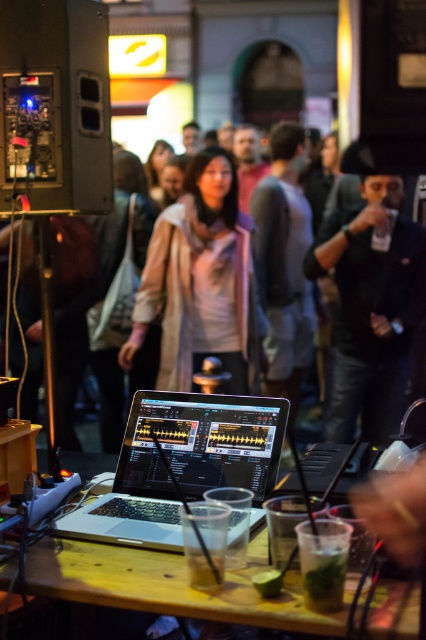
Question: Which object appears closest to the camera in this image?

Choices:
 (A) silver/black matte laptop at center
 (B) black leather jacket at right
 (C) wooden table at center

Answer: (C)

Question: Which point is farther to the camera?

Choices:
 (A) black leather jacket at right
 (B) matte white shirt at center
 (C) silver/black matte laptop at center
 (D) wooden table at center

Answer: (B)

Question: Is black leather jacket at right wider than silver/black matte laptop at center?

Choices:
 (A) no
 (B) yes

Answer: (B)

Question: Where is silver/black matte laptop at center located in relation to matte white shirt at center in the image?

Choices:
 (A) above
 (B) below

Answer: (B)

Question: Is black leather jacket at right closer to camera compared to silver/black matte laptop at center?

Choices:
 (A) no
 (B) yes

Answer: (A)

Question: Which object is positioned farthest from the black leather jacket at right?

Choices:
 (A) silver/black matte laptop at center
 (B) wooden table at center
 (C) matte white shirt at center

Answer: (B)